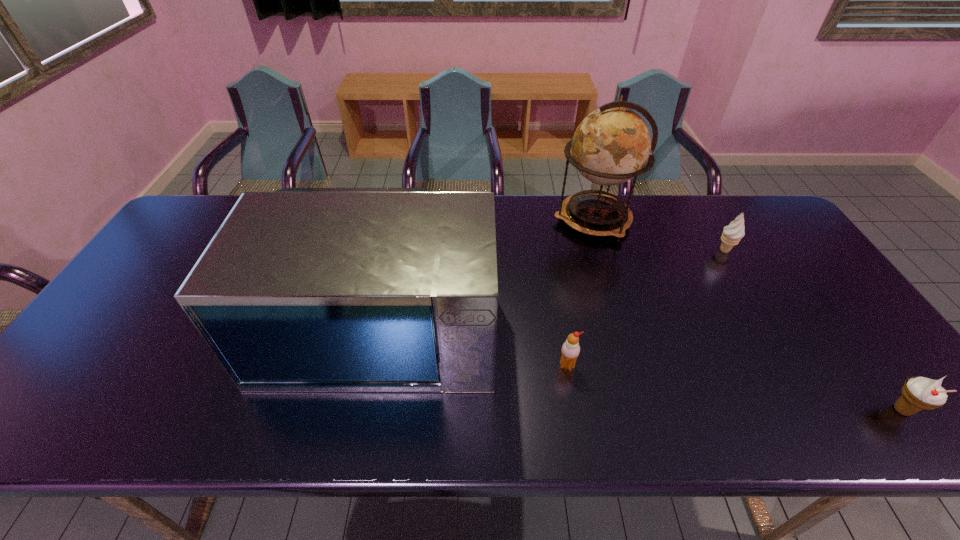
Find the location of a particular element. the tallest object is located at coordinates (611, 145).

Identify the location of the third object from left to right. (611, 145).

Locate an element on the screen. This screenshot has width=960, height=540. the leftmost object is located at coordinates [302, 290].

You are a GUI agent. You are given a task and a screenshot of the screen. Output one action in this format:
    pyautogui.click(x=<x>, y=<y>)
    Task: Click on the second tallest object
    
    Given the screenshot: What is the action you would take?
    pyautogui.click(x=302, y=290)

At what (x,y) coordinates should I click in order to perform the action: click on the farthest icecream. Please return your answer as a coordinate pair (x, y). The height and width of the screenshot is (540, 960). Looking at the image, I should click on (734, 232).

Identify the location of the second icecream from left to right. The image size is (960, 540). (734, 232).

Find the location of a particular element. the fourth object from right to left is located at coordinates (570, 350).

Where is `the second farthest icecream`? the second farthest icecream is located at coordinates (570, 350).

Locate an element on the screen. the rightmost icecream is located at coordinates (918, 393).

What are the coordinates of `the rightmost object` in the screenshot? It's located at (918, 393).